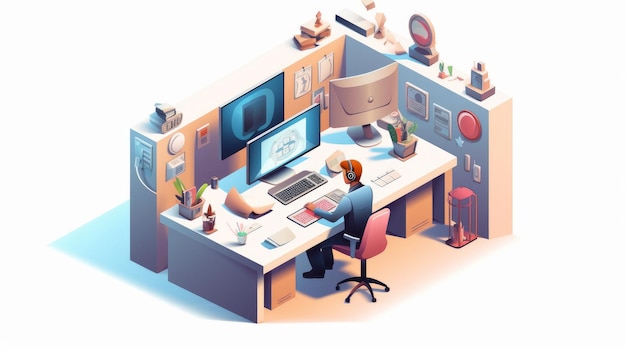
At what (x,y) coordinates should I click in order to perform the action: click on back of monitor. Please return your answer as a coordinate pair (x, y). Looking at the image, I should click on (362, 106).